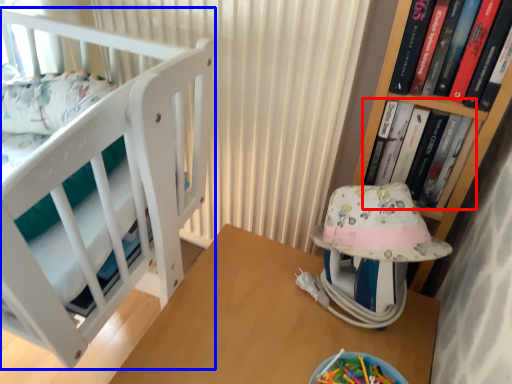
Question: Which object appears farthest to the camera in this image, book (highlighted by a red box) or furniture (highlighted by a blue box)?

Choices:
 (A) book
 (B) furniture

Answer: (A)